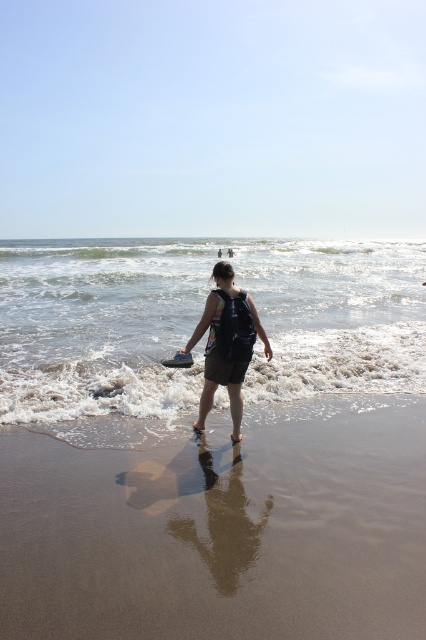
Measure the distance between brown sandy beach at lower center and camera.

brown sandy beach at lower center and camera are 3.11 meters apart from each other.

Can you confirm if brown sandy beach at lower center is taller than matte black backpack at center?

Incorrect, brown sandy beach at lower center's height is not larger of matte black backpack at center's.

The height and width of the screenshot is (640, 426). I want to click on brown sandy beach at lower center, so click(x=218, y=532).

Can you confirm if brown sandy beach at lower center is smaller than foamy white water at lower center?

Indeed, brown sandy beach at lower center has a smaller size compared to foamy white water at lower center.

What do you see at coordinates (218, 532) in the screenshot? I see `brown sandy beach at lower center` at bounding box center [218, 532].

Is point (304, 531) farther from camera compared to point (100, 372)?

No, (304, 531) is closer to viewer.

The width and height of the screenshot is (426, 640). What are the coordinates of `brown sandy beach at lower center` in the screenshot? It's located at (218, 532).

In the scene shown: Which is more to the right, foamy white water at lower center or matte black backpack at center?

From the viewer's perspective, matte black backpack at center appears more on the right side.

Which is in front, point (193, 259) or point (230, 369)?

Positioned in front is point (230, 369).

Identify the location of foamy white water at lower center. (100, 326).

Find the location of a particular element. This screenshot has width=426, height=640. foamy white water at lower center is located at coordinates (100, 326).